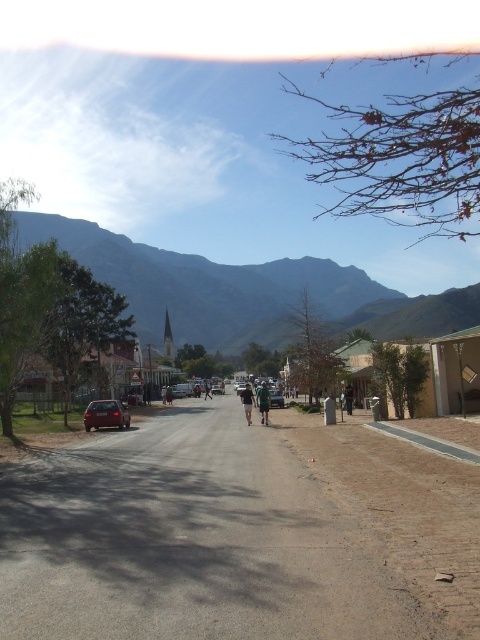
Question: Which is farther from the green fabric shirt at center?

Choices:
 (A) matte red car at left
 (B) gray rocky mountain at upper center
 (C) metallic silver car at center
 (D) dark gray fabric pants at center

Answer: (B)

Question: Among these objects, which one is farthest from the camera?

Choices:
 (A) matte red car at left
 (B) dark gray fabric pants at center
 (C) green fabric shirt at center
 (D) gray rocky mountain at upper center

Answer: (A)

Question: Does matte red car at left have a smaller size compared to green fabric shirt at center?

Choices:
 (A) yes
 (B) no

Answer: (A)

Question: Is matte red car at left to the left of metallic silver car at center from the viewer's perspective?

Choices:
 (A) yes
 (B) no

Answer: (A)

Question: Among these objects, which one is nearest to the camera?

Choices:
 (A) dark gray fabric pants at center
 (B) green fabric shirt at center
 (C) matte red car at left
 (D) metallic silver car at center

Answer: (B)

Question: Is matte red car at left smaller than metallic silver car at center?

Choices:
 (A) no
 (B) yes

Answer: (B)